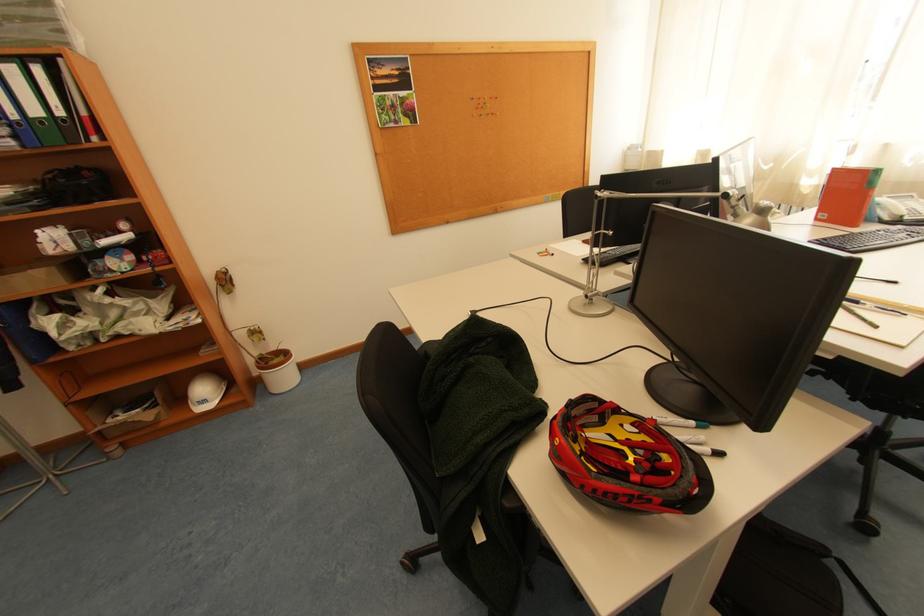
Image resolution: width=924 pixels, height=616 pixels. Find the location of `white flower pot`. white flower pot is located at coordinates (277, 370).